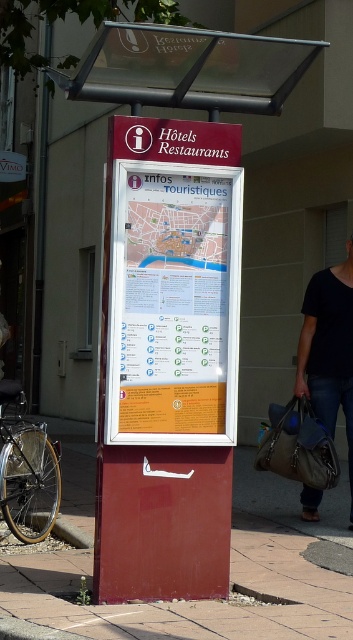
Question: Which of the following is the farthest from the observer?

Choices:
 (A) (140, 380)
 (B) (333, 296)

Answer: (B)

Question: Considering the relative positions of matte plastic signboard at center and leather textured bag at lower right in the image provided, where is matte plastic signboard at center located with respect to leather textured bag at lower right?

Choices:
 (A) right
 (B) left

Answer: (B)

Question: Which object is the farthest from the smooth concrete pavement at lower center?

Choices:
 (A) matte plastic signboard at center
 (B) leather textured bag at lower right

Answer: (A)

Question: Can you confirm if matte plastic signboard at center is smaller than leather textured bag at lower right?

Choices:
 (A) yes
 (B) no

Answer: (B)

Question: Considering the relative positions of matte plastic signboard at center and white paper poster at center in the image provided, where is matte plastic signboard at center located with respect to white paper poster at center?

Choices:
 (A) above
 (B) below

Answer: (B)

Question: Among these points, which one is nearest to the camera?

Choices:
 (A) (279, 611)
 (B) (306, 336)

Answer: (A)